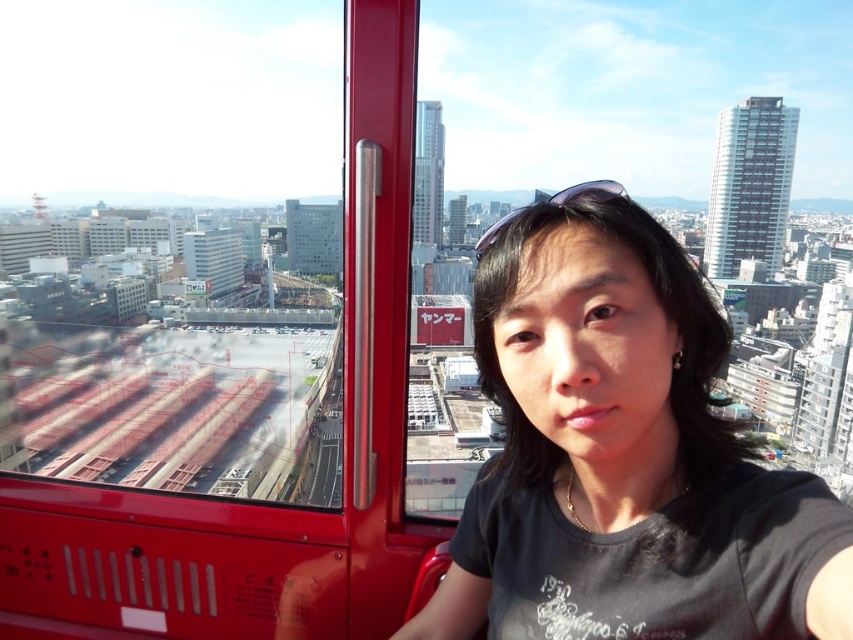
Can you confirm if transparent glass window at upper center is thinner than black matte shirt at center?

In fact, transparent glass window at upper center might be wider than black matte shirt at center.

Looking at this image, is transparent glass window at upper center bigger than black matte shirt at center?

Yes, transparent glass window at upper center is bigger than black matte shirt at center.

Image resolution: width=853 pixels, height=640 pixels. Identify the location of transparent glass window at upper center. (177, 244).

This screenshot has height=640, width=853. In order to click on transparent glass window at upper center in this screenshot , I will do `click(177, 244)`.